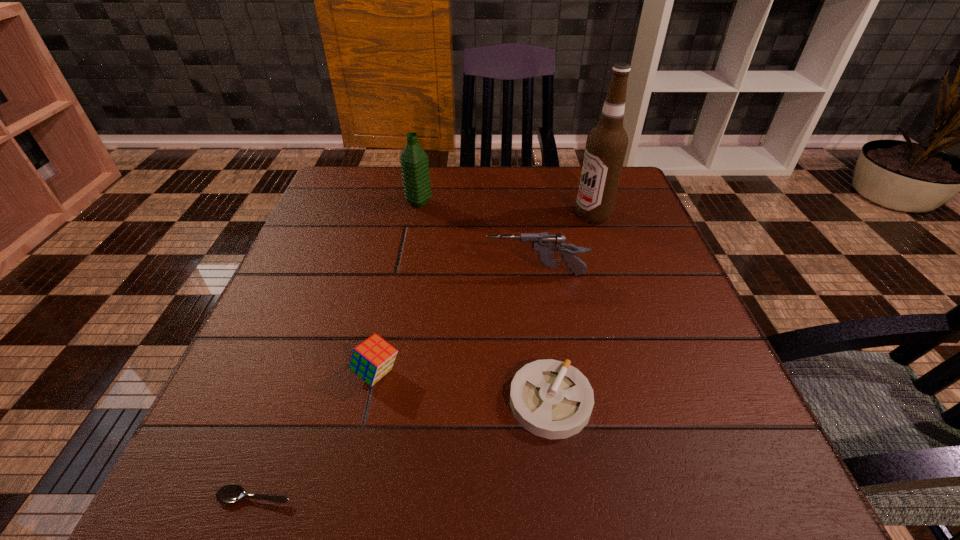
Locate an element on the screen. vacant point located between the gun and the fourth tallest object is located at coordinates (456, 323).

Find the location of `free spot between the alcohol and the nearest object`. free spot between the alcohol and the nearest object is located at coordinates (423, 356).

At what (x,y) coordinates should I click in order to perform the action: click on object identified as the third closest to the soupspoon. Please return your answer as a coordinate pair (x, y). Image resolution: width=960 pixels, height=540 pixels. Looking at the image, I should click on (545, 245).

Select which object appears as the fifth closest to the fourth tallest object. Please provide its 2D coordinates. Your answer should be formatted as a tuple, i.e. [(x, y)], where the tuple contains the x and y coordinates of a point satisfying the conditions above.

[(606, 145)]

Where is `free space in the image that satisfies the following two spatial constraints: 1. on the label of the tallest object; 2. on the front side of the nearest object`? free space in the image that satisfies the following two spatial constraints: 1. on the label of the tallest object; 2. on the front side of the nearest object is located at coordinates (686, 496).

This screenshot has height=540, width=960. Find the location of `free space that satisfies the following two spatial constraints: 1. at the barrel of the fourth nearest object; 2. on the front side of the cube`. free space that satisfies the following two spatial constraints: 1. at the barrel of the fourth nearest object; 2. on the front side of the cube is located at coordinates (550, 373).